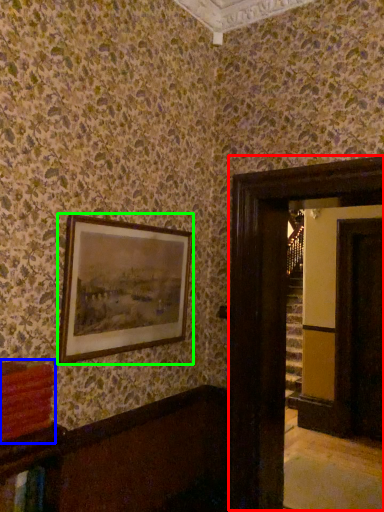
Question: Estimate the real-world distances between objects in this image. Which object is farther from glass door (highlighted by a red box), book (highlighted by a blue box) or picture frame (highlighted by a green box)?

Choices:
 (A) book
 (B) picture frame

Answer: (A)